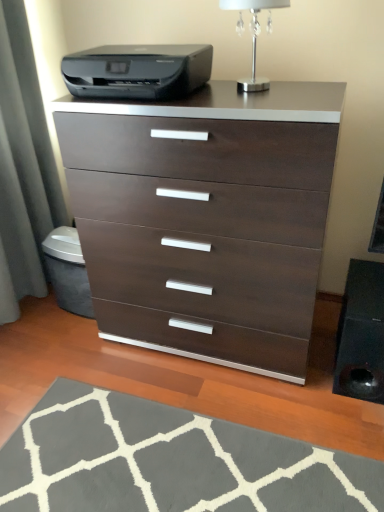
The height and width of the screenshot is (512, 384). I want to click on vacant area in front of dark wood/finish chest of drawers at center, so click(204, 432).